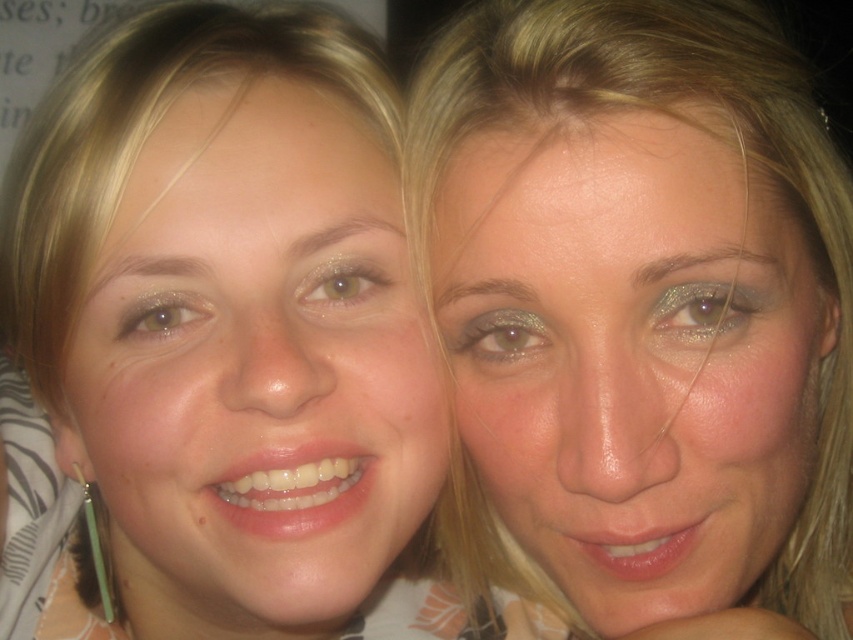
Question: Does smooth skin face at center appear under matte skin face at center?

Choices:
 (A) no
 (B) yes

Answer: (A)

Question: Is smooth skin face at center thinner than matte skin face at center?

Choices:
 (A) yes
 (B) no

Answer: (B)

Question: Which of the following is the farthest from the observer?

Choices:
 (A) (16, 312)
 (B) (701, 312)

Answer: (A)

Question: Observing the image, what is the correct spatial positioning of smooth skin face at center in reference to matte skin face at center?

Choices:
 (A) right
 (B) left

Answer: (B)

Question: Which of the following is the farthest from the observer?

Choices:
 (A) smooth skin face at center
 (B) matte skin face at center

Answer: (B)